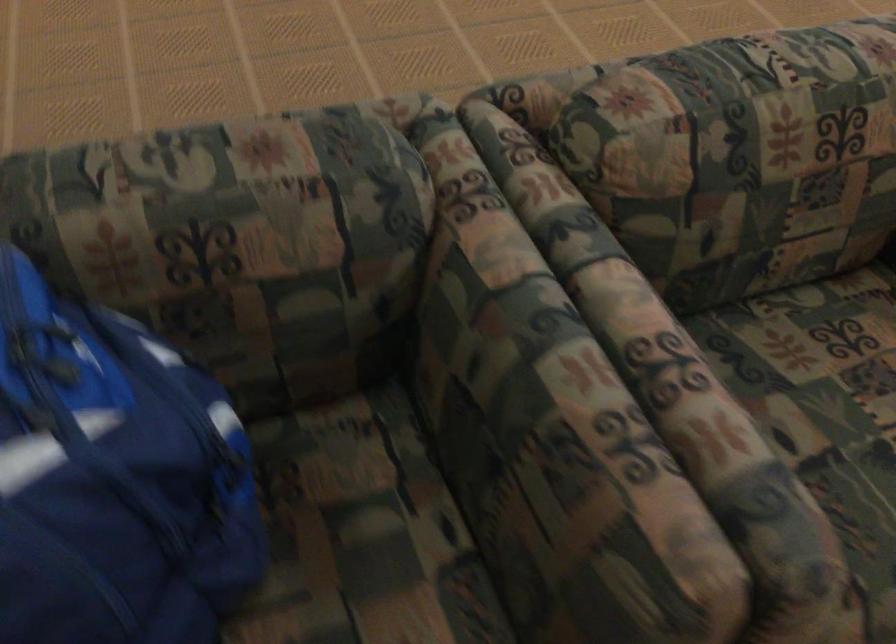
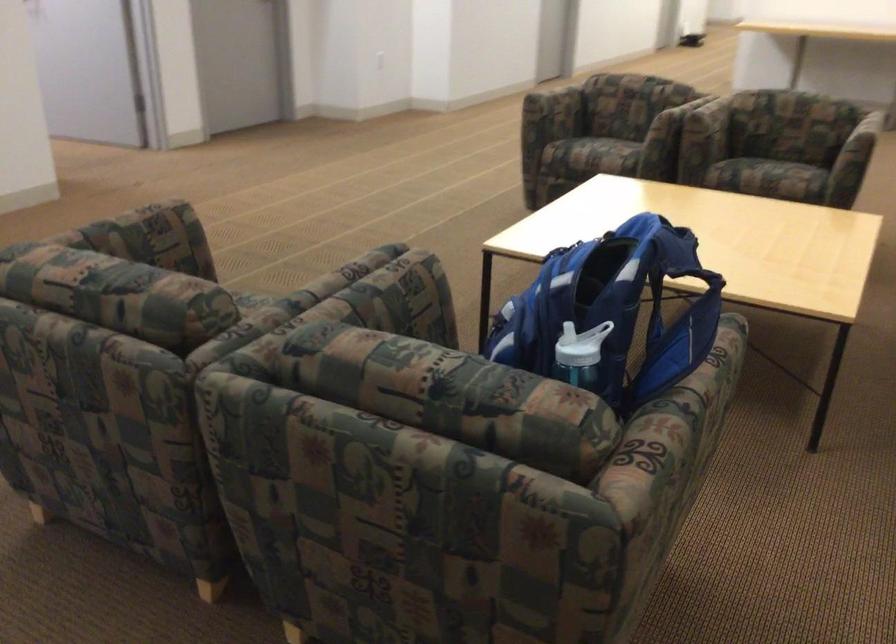
Locate, in the second image, the point that corresponds to (x=544, y=343) in the first image.

(362, 292)